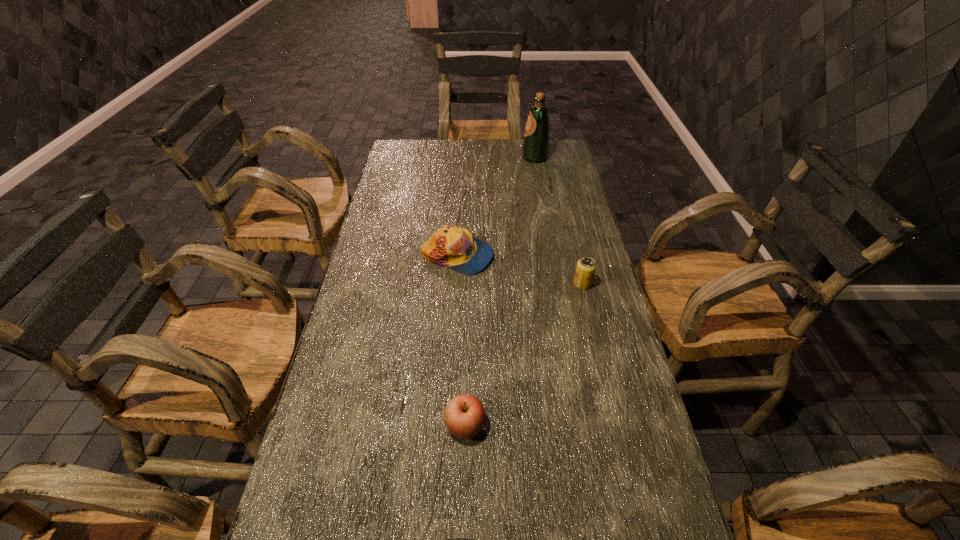
This screenshot has height=540, width=960. In order to click on vacant space located on the back of the apple in this screenshot , I will do `click(468, 300)`.

I want to click on object located at the far edge, so click(x=535, y=149).

Locate an element on the screen. olive oil that is at the right edge is located at coordinates (535, 149).

Where is `beer can at the right edge`? beer can at the right edge is located at coordinates (585, 270).

I want to click on object situated at the far right corner, so click(x=535, y=149).

What are the coordinates of `free space at the far edge` in the screenshot? It's located at (462, 160).

At what (x,y) coordinates should I click in order to perform the action: click on free space at the left edge of the desktop. Please return your answer as a coordinate pair (x, y). This screenshot has width=960, height=540. Looking at the image, I should click on (319, 415).

You are a GUI agent. You are given a task and a screenshot of the screen. Output one action in this format:
    pyautogui.click(x=<x>, y=<y>)
    Task: Click on the vacant space at the right edge of the desktop
    The width and height of the screenshot is (960, 540).
    Given the screenshot: What is the action you would take?
    pyautogui.click(x=590, y=366)

The image size is (960, 540). I want to click on free location at the far left corner of the desktop, so click(397, 143).

Find the location of a particular element. This screenshot has height=540, width=960. free space between the cap and the olive oil is located at coordinates (496, 207).